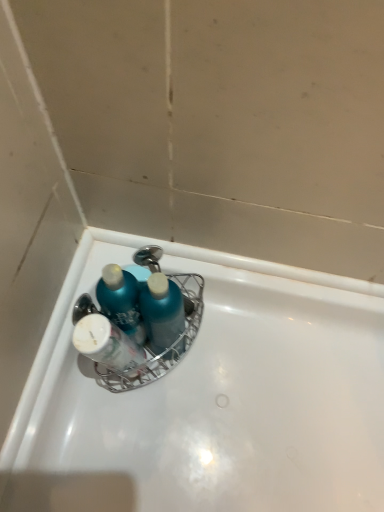
Question: Is blue glossy bottle at upper center positioned beyond the bounds of white glossy bottle at center?

Choices:
 (A) no
 (B) yes

Answer: (B)

Question: From a real-world perspective, is blue glossy bottle at upper center under white glossy bottle at center?

Choices:
 (A) yes
 (B) no

Answer: (A)

Question: Is blue glossy bottle at upper center to the right of white glossy bottle at center from the viewer's perspective?

Choices:
 (A) yes
 (B) no

Answer: (A)

Question: Is blue glossy bottle at upper center shorter than white glossy bottle at center?

Choices:
 (A) yes
 (B) no

Answer: (A)

Question: Could you tell me if blue glossy bottle at upper center is facing white glossy bottle at center?

Choices:
 (A) no
 (B) yes

Answer: (B)

Question: From the image's perspective, does blue glossy bottle at upper center appear lower than white glossy bottle at center?

Choices:
 (A) yes
 (B) no

Answer: (B)

Question: Can you confirm if white glossy bathtub at center is taller than blue glossy bottle at upper center?

Choices:
 (A) no
 (B) yes

Answer: (A)

Question: Is white glossy bathtub at center not inside blue glossy bottle at upper center?

Choices:
 (A) yes
 (B) no

Answer: (A)

Question: Is blue glossy bottle at upper center at the back of white glossy bathtub at center?

Choices:
 (A) no
 (B) yes

Answer: (A)

Question: From a real-world perspective, does white glossy bathtub at center stand above blue glossy bottle at upper center?

Choices:
 (A) yes
 (B) no

Answer: (B)

Question: Is white glossy bathtub at center further to camera compared to blue glossy bottle at upper center?

Choices:
 (A) yes
 (B) no

Answer: (A)

Question: Can you confirm if white glossy bathtub at center is positioned to the right of blue glossy bottle at upper center?

Choices:
 (A) yes
 (B) no

Answer: (A)

Question: Is white glossy bottle at center oriented away from blue glossy bottle at upper center?

Choices:
 (A) yes
 (B) no

Answer: (A)